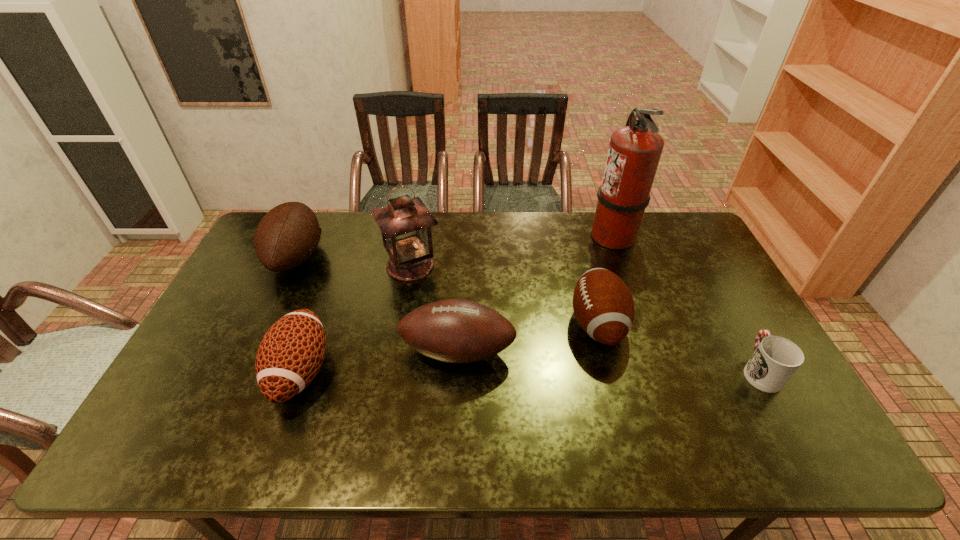
The height and width of the screenshot is (540, 960). I want to click on free point between the cup and the tallest object, so click(686, 303).

Where is `unoccupied position between the oil lamp and the tallest object`? The width and height of the screenshot is (960, 540). unoccupied position between the oil lamp and the tallest object is located at coordinates (512, 251).

You are a GUI agent. You are given a task and a screenshot of the screen. Output one action in this format:
    pyautogui.click(x=<x>, y=<y>)
    Task: Click on the vacant region between the sixth shortest object and the rightmost football
    The height and width of the screenshot is (540, 960).
    Given the screenshot: What is the action you would take?
    pyautogui.click(x=504, y=295)

Locate which object is the closest to the tallest object. Please provide its 2D coordinates. Your answer should be formatted as a tuple, i.e. [(x, y)], where the tuple contains the x and y coordinates of a point satisfying the conditions above.

[(602, 303)]

Locate an element on the screen. object that ranks as the sixth closest to the rightmost football is located at coordinates (287, 235).

This screenshot has width=960, height=540. Identify the location of the closest football to the rightmost object. (602, 303).

Where is `football that is the fourth closest one to the rightmost object`? This screenshot has height=540, width=960. football that is the fourth closest one to the rightmost object is located at coordinates (287, 235).

Identify the location of vacant space that satisfies the following two spatial constraints: 1. on the front side of the second football from right to left; 2. on the right side of the second tallest object. (396, 351).

This screenshot has width=960, height=540. In order to click on free point that satisfies the following two spatial constraints: 1. on the laces of the rightmost football; 2. on the front side of the second football from right to left in this screenshot , I will do `click(605, 351)`.

Identify the location of vacant point that satisfies the following two spatial constraints: 1. on the laces of the rightmost football; 2. on the handle side of the shortest object. (610, 370).